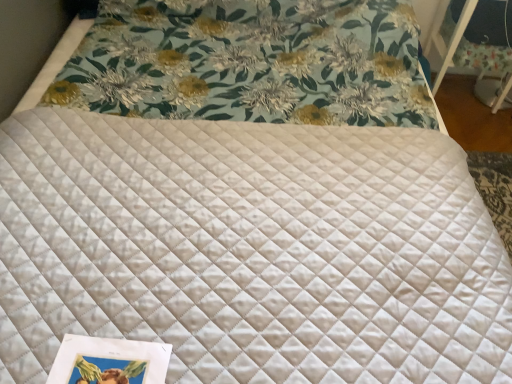
Question: Should I look upward or downward to see white quilted table at upper right?

Choices:
 (A) down
 (B) up

Answer: (B)